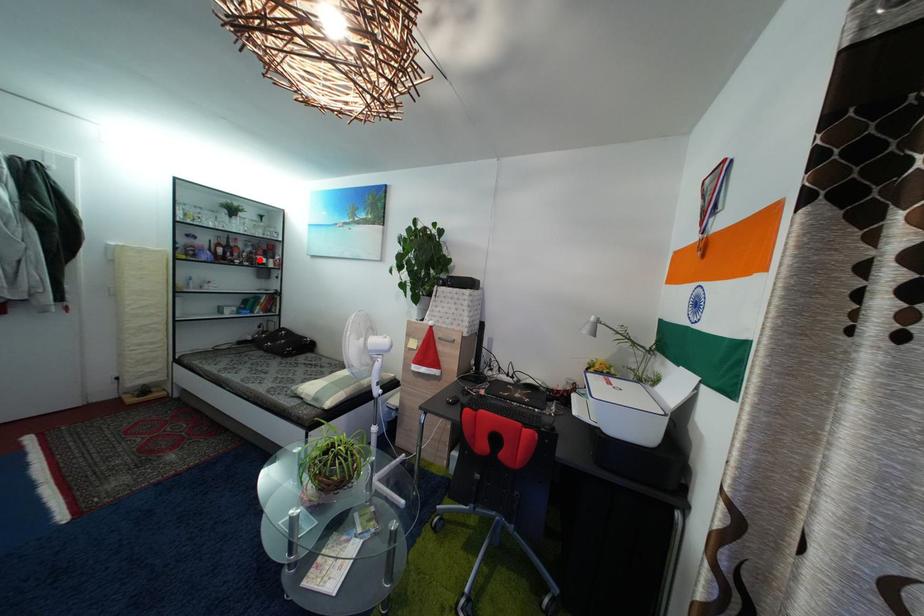
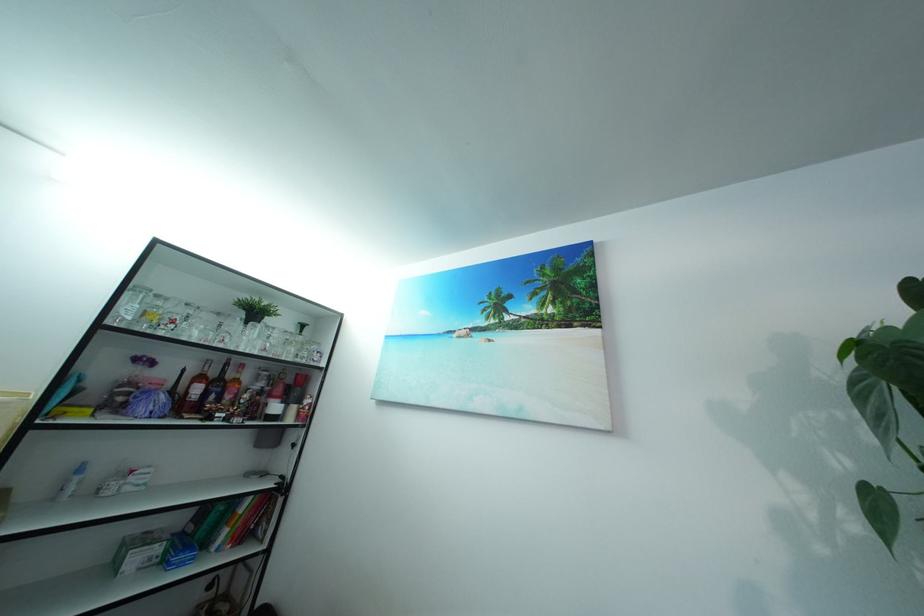
Locate, in the second image, the point that corresponds to the highlighted location in the first image.

(269, 400)